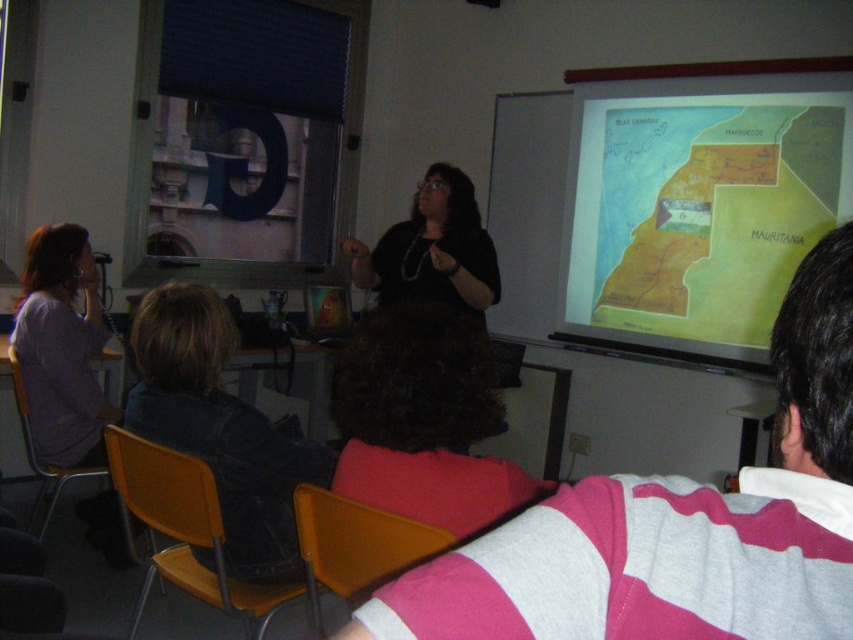
From the picture: Can you confirm if striped cotton shirt at center is taller than yellow paper map at upper right?

No, striped cotton shirt at center is not taller than yellow paper map at upper right.

Is striped cotton shirt at center further to the viewer compared to yellow paper map at upper right?

No, it is not.

Is point (740, 600) closer to camera compared to point (727, 308)?

Yes, it is.

Where is `striped cotton shirt at center`? striped cotton shirt at center is located at coordinates (675, 524).

Is yellow paper map at upper right smaller than dark blue jacket at lower left?

Incorrect, yellow paper map at upper right is not smaller in size than dark blue jacket at lower left.

Is yellow paper map at upper right shorter than dark blue jacket at lower left?

No, yellow paper map at upper right is not shorter than dark blue jacket at lower left.

Is point (722, 305) less distant than point (213, 344)?

No, it is behind (213, 344).

Locate an element on the screen. yellow paper map at upper right is located at coordinates (708, 214).

Who is positioned more to the right, striped cotton shirt at center or dark blue jacket at lower left?

striped cotton shirt at center

Where is `striped cotton shirt at center`? The image size is (853, 640). striped cotton shirt at center is located at coordinates (675, 524).

Is point (554, 612) farther from viewer compared to point (173, 358)?

No, it is in front of (173, 358).

I want to click on striped cotton shirt at center, so click(675, 524).